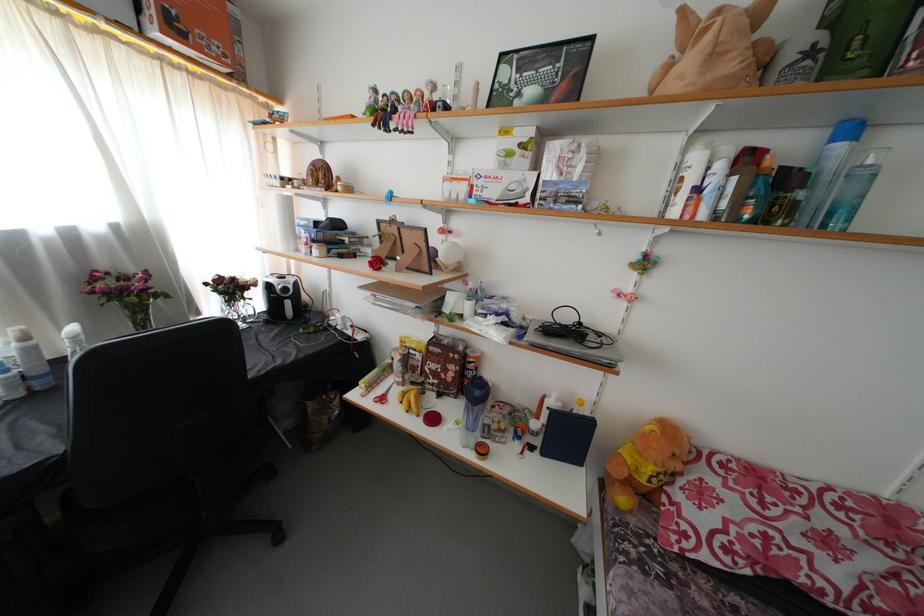
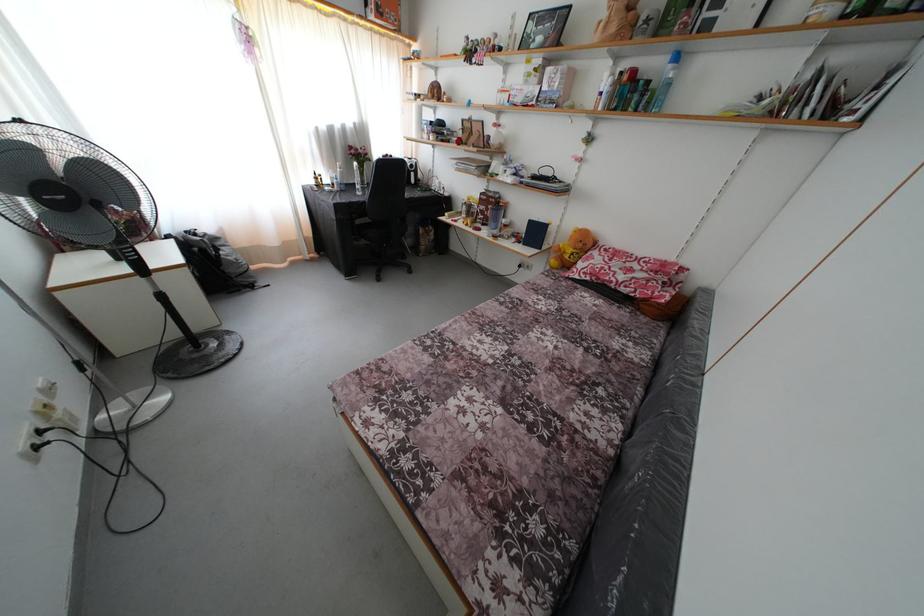
In the second image, find the point that corresponds to point 684,472 in the first image.

(585, 251)